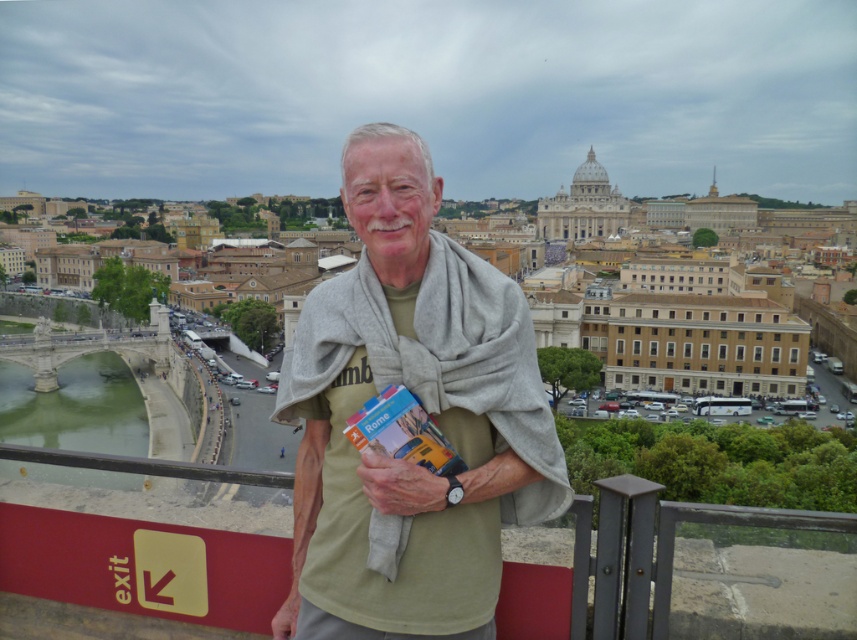
Question: Is light green cotton shirt at center smaller than light brown leather hand at center?

Choices:
 (A) yes
 (B) no

Answer: (B)

Question: Does light green cotton shirt at center have a larger size compared to light brown leather hand at center?

Choices:
 (A) yes
 (B) no

Answer: (A)

Question: From the image, what is the correct spatial relationship of light green cotton shirt at center in relation to light brown leather hand at center?

Choices:
 (A) below
 (B) above

Answer: (B)

Question: Which of the following is the closest to the observer?

Choices:
 (A) (411, 490)
 (B) (424, 188)

Answer: (A)

Question: Which object appears farthest from the camera in this image?

Choices:
 (A) light green cotton shirt at center
 (B) light brown leather hand at center

Answer: (B)